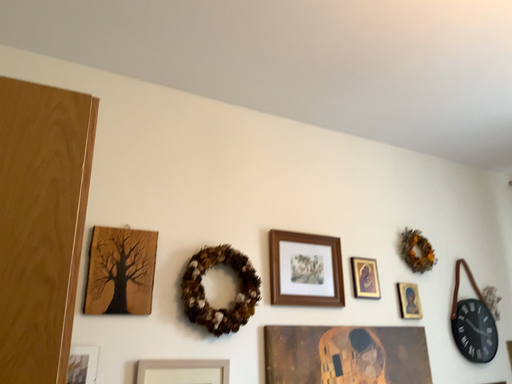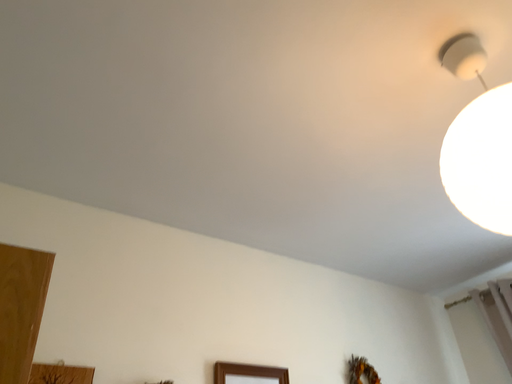
Question: Which way did the camera rotate in the video?

Choices:
 (A) rotated upward
 (B) rotated downward

Answer: (A)